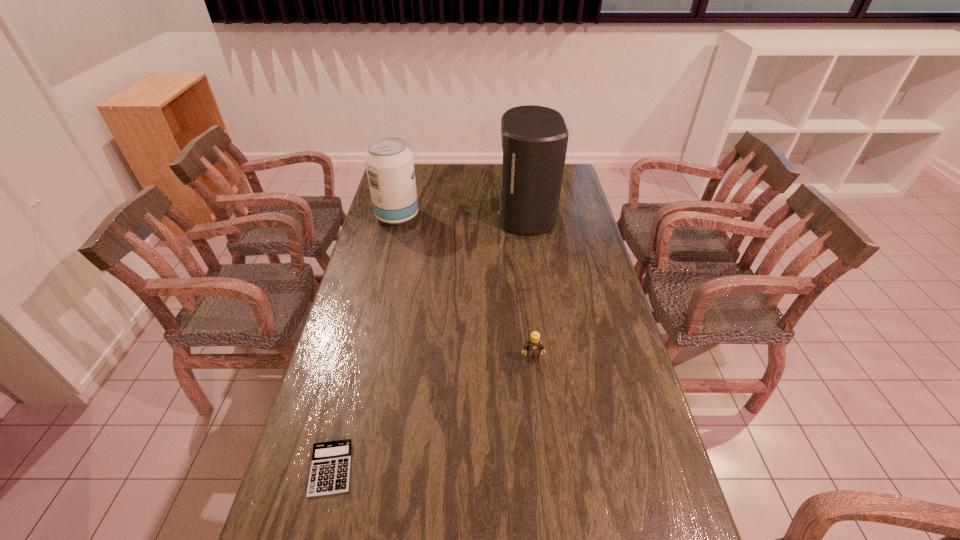
Find the location of a particular element. The image size is (960, 540). free location that satisfies the following two spatial constraints: 1. on the button side of the tallest object; 2. in front of the second nearest object is located at coordinates point(545,359).

You are a GUI agent. You are given a task and a screenshot of the screen. Output one action in this format:
    pyautogui.click(x=<x>, y=<y>)
    Task: Click on the vacant space that satisfies the following two spatial constraints: 1. on the button side of the tallest object; 2. in front of the second nearest object
    
    Given the screenshot: What is the action you would take?
    pyautogui.click(x=545, y=359)